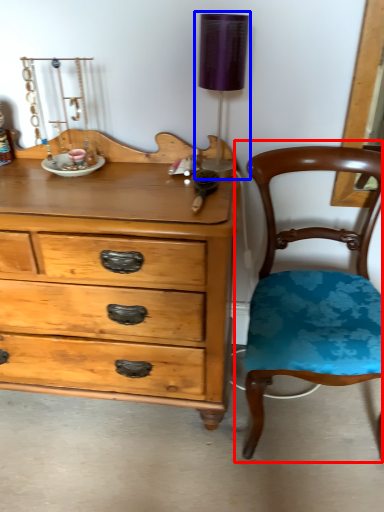
Question: Which of the following is the closest to the observer, chair (highlighted by a red box) or table lamp (highlighted by a blue box)?

Choices:
 (A) chair
 (B) table lamp

Answer: (A)